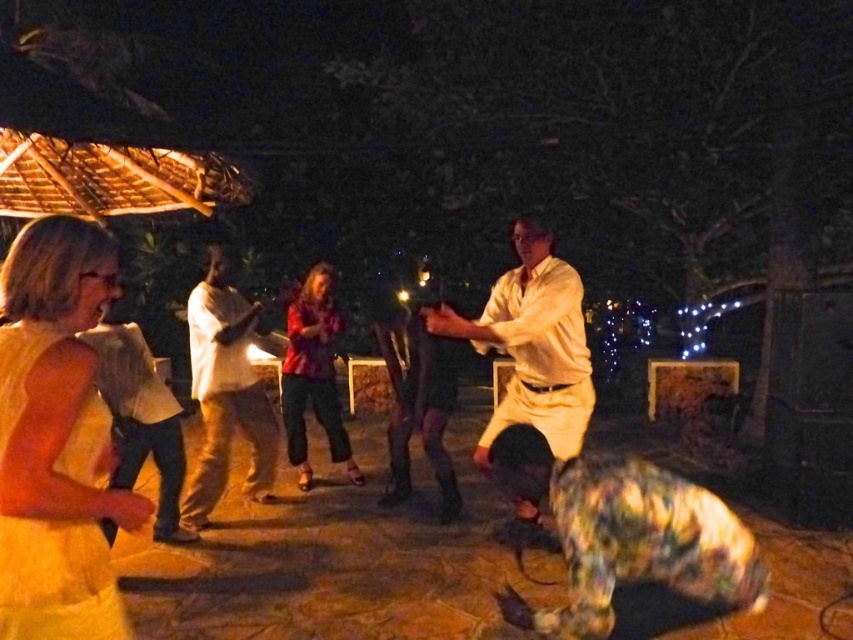
Question: Which of the following is the closest to the observer?

Choices:
 (A) light brown leather jacket at left
 (B) light brown cotton shirt at center

Answer: (A)

Question: Can you confirm if light beige cotton shirt at center is positioned to the left of light brown leather jacket at left?

Choices:
 (A) no
 (B) yes

Answer: (A)

Question: Which is farther from the light brown cotton shirt at center?

Choices:
 (A) yellow fabric dress at lower left
 (B) light brown leather jacket at left
 (C) printed cotton blouse at center
 (D) light beige cotton shirt at center

Answer: (A)

Question: Is light brown cotton shirt at center smaller than printed cotton blouse at center?

Choices:
 (A) no
 (B) yes

Answer: (A)

Question: Is yellow fabric dress at lower left closer to camera compared to light beige cotton shirt at center?

Choices:
 (A) no
 (B) yes

Answer: (B)

Question: Which of these objects is positioned farthest from the light beige cotton shirt at center?

Choices:
 (A) light brown cotton shirt at center
 (B) yellow fabric dress at lower left
 (C) light brown leather jacket at left

Answer: (C)